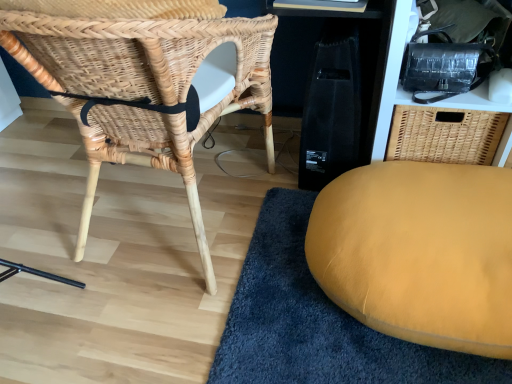
Question: Is black textured bag at upper right smaller than mustard yellow cushion at lower right?

Choices:
 (A) no
 (B) yes

Answer: (A)

Question: Is black textured bag at upper right taller than mustard yellow cushion at lower right?

Choices:
 (A) no
 (B) yes

Answer: (B)

Question: From the image's perspective, is black textured bag at upper right located above mustard yellow cushion at lower right?

Choices:
 (A) no
 (B) yes

Answer: (B)

Question: Does black textured bag at upper right have a greater width compared to mustard yellow cushion at lower right?

Choices:
 (A) yes
 (B) no

Answer: (B)

Question: Considering the relative sizes of black textured bag at upper right and mustard yellow cushion at lower right in the image provided, is black textured bag at upper right thinner than mustard yellow cushion at lower right?

Choices:
 (A) no
 (B) yes

Answer: (B)

Question: From a real-world perspective, is black textured bag at upper right below mustard yellow cushion at lower right?

Choices:
 (A) no
 (B) yes

Answer: (A)

Question: Does black textured bag at upper right lie behind natural woven chair at left?

Choices:
 (A) yes
 (B) no

Answer: (A)

Question: Is black textured bag at upper right oriented away from natural woven chair at left?

Choices:
 (A) yes
 (B) no

Answer: (B)

Question: Is the depth of black textured bag at upper right less than that of natural woven chair at left?

Choices:
 (A) yes
 (B) no

Answer: (B)

Question: Does black textured bag at upper right have a smaller size compared to natural woven chair at left?

Choices:
 (A) no
 (B) yes

Answer: (B)

Question: From a real-world perspective, is black textured bag at upper right on natural woven chair at left?

Choices:
 (A) no
 (B) yes

Answer: (A)

Question: Is black textured bag at upper right at the right side of natural woven chair at left?

Choices:
 (A) no
 (B) yes

Answer: (B)

Question: From the image's perspective, does mustard yellow cushion at lower right appear lower than black textured bag at upper right?

Choices:
 (A) no
 (B) yes

Answer: (B)